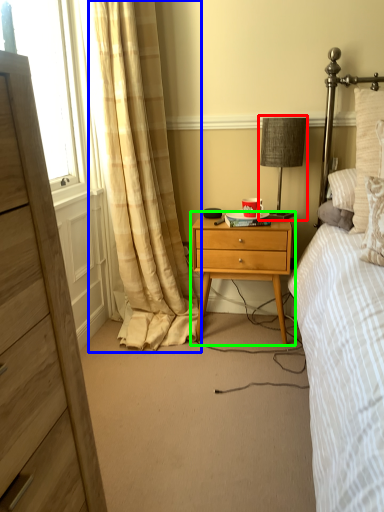
Question: Which object is positioned farthest from bedside lamp (highlighted by a red box)? Select from curtain (highlighted by a blue box) and nightstand (highlighted by a green box).

Choices:
 (A) curtain
 (B) nightstand

Answer: (A)